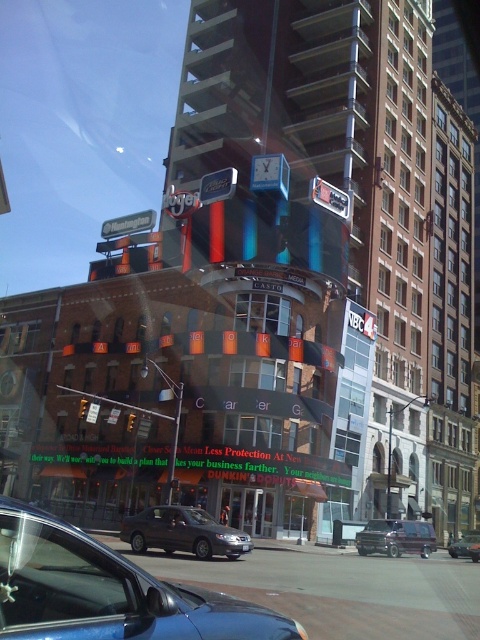
Question: Estimate the real-world distances between objects in this image. Which object is farther from the dark gray metallic sedan at center?

Choices:
 (A) matte black sedan at center
 (B) metallic purple van at center
 (C) metallic blue sedan at center

Answer: (A)

Question: Can you confirm if metallic purple van at center is positioned above matte black sedan at center?

Choices:
 (A) yes
 (B) no

Answer: (B)

Question: Among these points, which one is farthest from the camera?

Choices:
 (A) (225, 525)
 (B) (382, 532)

Answer: (A)

Question: Which object is closer to the camera taking this photo?

Choices:
 (A) metallic purple van at center
 (B) metallic blue sedan at center
 (C) dark gray metallic sedan at center

Answer: (B)

Question: Is metallic blue sedan at center closer to camera compared to matte black sedan at center?

Choices:
 (A) yes
 (B) no

Answer: (A)

Question: Does metallic purple van at center appear over matte black sedan at center?

Choices:
 (A) yes
 (B) no

Answer: (B)